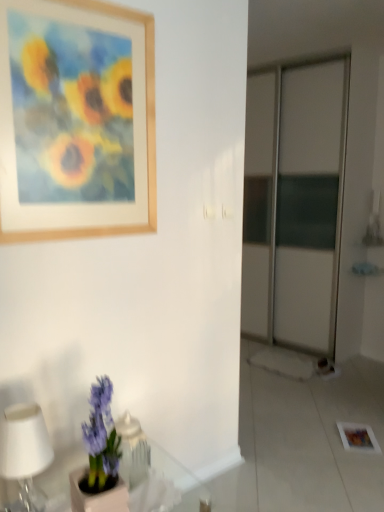
Question: Relative to purple matte hyacinth at lower left, is white matte table lamp at lower left in front or behind?

Choices:
 (A) front
 (B) behind

Answer: (B)

Question: Looking at their shapes, would you say white matte table lamp at lower left is wider or thinner than purple matte hyacinth at lower left?

Choices:
 (A) wide
 (B) thin

Answer: (B)

Question: Which of these objects is positioned closest to the translucent glass table at lower left?

Choices:
 (A) purple matte hyacinth at lower left
 (B) wooden picture frame at upper left
 (C) white matte table lamp at lower left

Answer: (A)

Question: Which is farther from the wooden picture frame at upper left?

Choices:
 (A) translucent glass table at lower left
 (B) white matte table lamp at lower left
 (C) purple matte hyacinth at lower left

Answer: (A)